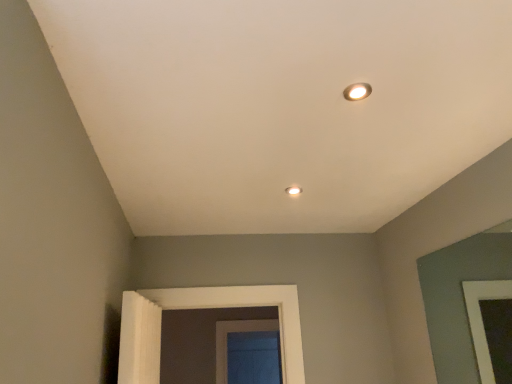
Question: Considering the positions of point (353, 86) and point (291, 193), is point (353, 86) closer or farther from the camera than point (291, 193)?

Choices:
 (A) closer
 (B) farther

Answer: (A)

Question: From a real-world perspective, is matte white recessed light at upper right positioned above or below matte white lamp at upper center?

Choices:
 (A) above
 (B) below

Answer: (A)

Question: Considering their positions, is matte white recessed light at upper right located in front of or behind matte white lamp at upper center?

Choices:
 (A) front
 (B) behind

Answer: (A)

Question: Does point (289, 190) appear closer or farther from the camera than point (352, 84)?

Choices:
 (A) closer
 (B) farther

Answer: (B)

Question: Is matte white lamp at upper center in front of or behind matte white recessed light at upper right in the image?

Choices:
 (A) front
 (B) behind

Answer: (B)

Question: In terms of width, does matte white lamp at upper center look wider or thinner when compared to matte white recessed light at upper right?

Choices:
 (A) wide
 (B) thin

Answer: (A)

Question: From a real-world perspective, is matte white lamp at upper center above or below matte white recessed light at upper right?

Choices:
 (A) below
 (B) above

Answer: (A)